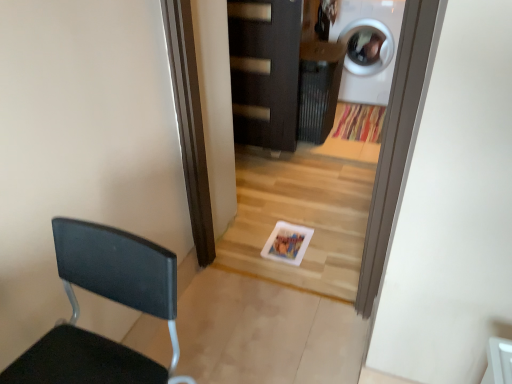
Question: Is white glossy washing machine at upper right not close to dark wood door at center?

Choices:
 (A) yes
 (B) no

Answer: (B)

Question: Considering the relative sizes of white glossy washing machine at upper right and dark wood door at center in the image provided, is white glossy washing machine at upper right taller than dark wood door at center?

Choices:
 (A) no
 (B) yes

Answer: (A)

Question: Can you confirm if white glossy washing machine at upper right is shorter than dark wood door at center?

Choices:
 (A) no
 (B) yes

Answer: (B)

Question: Is white glossy washing machine at upper right facing towards dark wood door at center?

Choices:
 (A) no
 (B) yes

Answer: (B)

Question: Is white glossy washing machine at upper right to the right of dark wood door at center from the viewer's perspective?

Choices:
 (A) no
 (B) yes

Answer: (B)

Question: Can you confirm if white glossy washing machine at upper right is wider than dark wood door at center?

Choices:
 (A) no
 (B) yes

Answer: (B)

Question: Could you tell me if black matte chair at left is facing white glossy washing machine at upper right?

Choices:
 (A) yes
 (B) no

Answer: (B)

Question: Can you confirm if black matte chair at left is positioned to the left of white glossy washing machine at upper right?

Choices:
 (A) no
 (B) yes

Answer: (B)

Question: Considering the relative sizes of black matte chair at left and white glossy washing machine at upper right in the image provided, is black matte chair at left taller than white glossy washing machine at upper right?

Choices:
 (A) yes
 (B) no

Answer: (B)

Question: Is black matte chair at left directly adjacent to white glossy washing machine at upper right?

Choices:
 (A) yes
 (B) no

Answer: (B)

Question: Would you consider black matte chair at left to be distant from white glossy washing machine at upper right?

Choices:
 (A) yes
 (B) no

Answer: (A)

Question: Is black matte chair at left looking in the opposite direction of white glossy washing machine at upper right?

Choices:
 (A) no
 (B) yes

Answer: (B)

Question: Does black matte chair at left contain dark wood door at center?

Choices:
 (A) yes
 (B) no

Answer: (B)